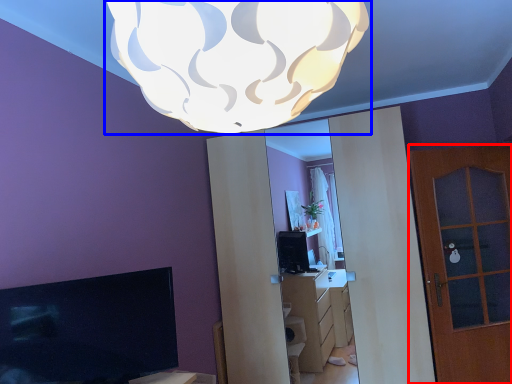
Question: Which object is further to the camera taking this photo, door (highlighted by a red box) or lamp (highlighted by a blue box)?

Choices:
 (A) door
 (B) lamp

Answer: (A)